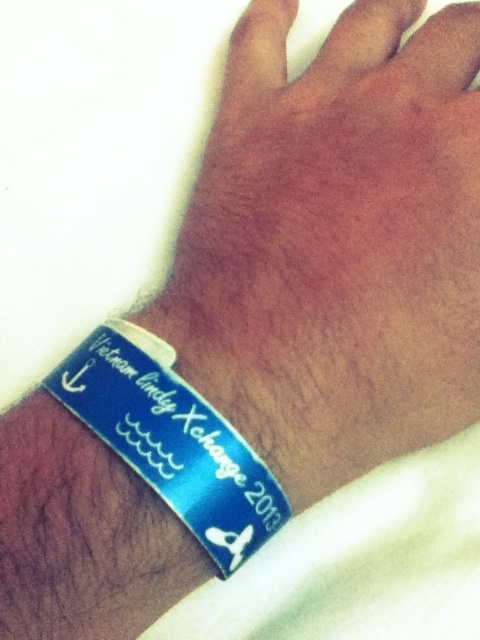
Is point (273, 83) farther from camera compared to point (213, 509)?

Yes, point (273, 83) is farther from viewer.

Which is more to the right, blue matte wristband at lower left or blue glossy wristband at lower left?

Positioned to the right is blue matte wristband at lower left.

Measure the distance between blue matte wristband at lower left and camera.

blue matte wristband at lower left is 17.60 inches from camera.

In order to click on blue matte wristband at lower left in this screenshot , I will do [336, 243].